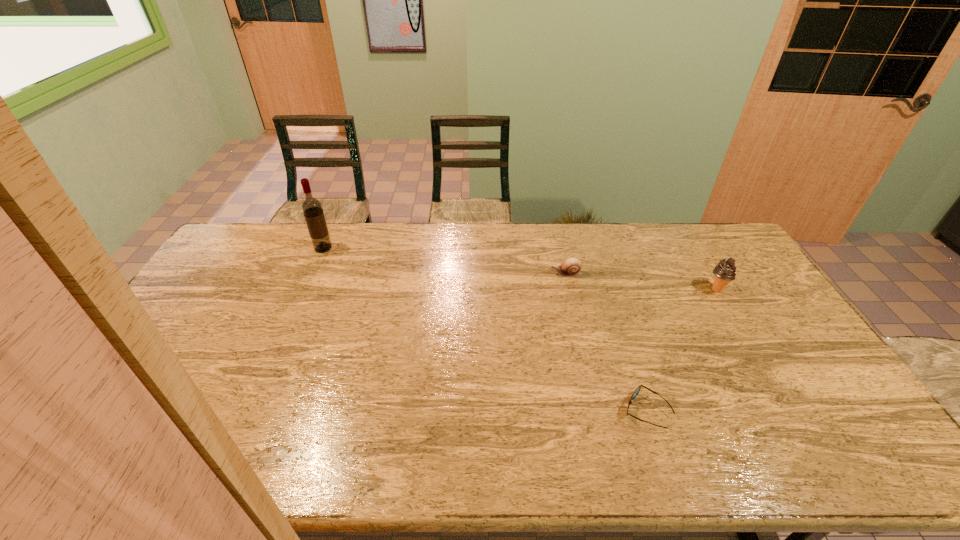
At what (x,y) coordinates should I click in order to perform the action: click on the leftmost object. Please return your answer as a coordinate pair (x, y). The image size is (960, 540). Looking at the image, I should click on (312, 209).

At what (x,y) coordinates should I click in order to perform the action: click on wine bottle. Please return your answer as a coordinate pair (x, y). Looking at the image, I should click on (312, 209).

Find the location of `the third shortest object`. the third shortest object is located at coordinates [x=725, y=271].

The height and width of the screenshot is (540, 960). In order to click on the third farthest object in this screenshot , I will do `click(725, 271)`.

The width and height of the screenshot is (960, 540). Identify the location of the second shortest object. click(x=570, y=267).

The image size is (960, 540). What are the coordinates of `the second object from left to right` in the screenshot? It's located at (570, 267).

Image resolution: width=960 pixels, height=540 pixels. I want to click on the third object from left to right, so click(x=637, y=390).

Find the location of `the nearest object`. the nearest object is located at coordinates (637, 390).

Find the location of `vacant point located on the right of the wine bottle`. vacant point located on the right of the wine bottle is located at coordinates (434, 248).

Identify the location of vacant region located 0.190m on the front of the rightmost object. (747, 341).